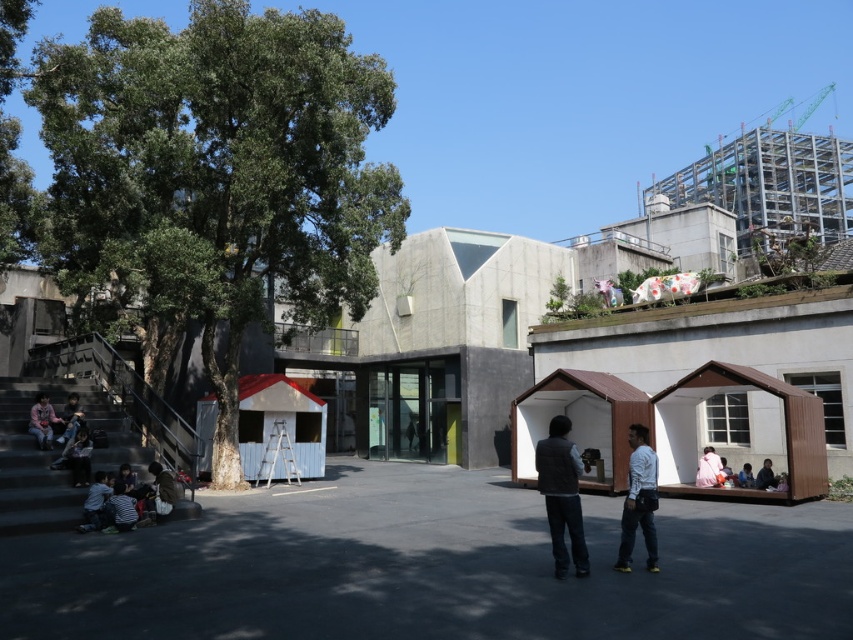
You are a fashion designer observing the outdoor urban scene. You notice the dark gray vest at center and the dark brown leather jacket at lower right. Which clothing item appears taller in the image?

The dark gray vest at center is taller than the dark brown leather jacket at lower right.

In the scene shown: You are a photographer standing at the edge of the paved area in the outdoor urban scene. You notice the dark gray vest at center and the dark brown leather jacket at lower right. Which clothing item is positioned higher relative to the other?

The dark gray vest at center is located above the dark brown leather jacket at lower right, so the dark gray vest at center is positioned higher.